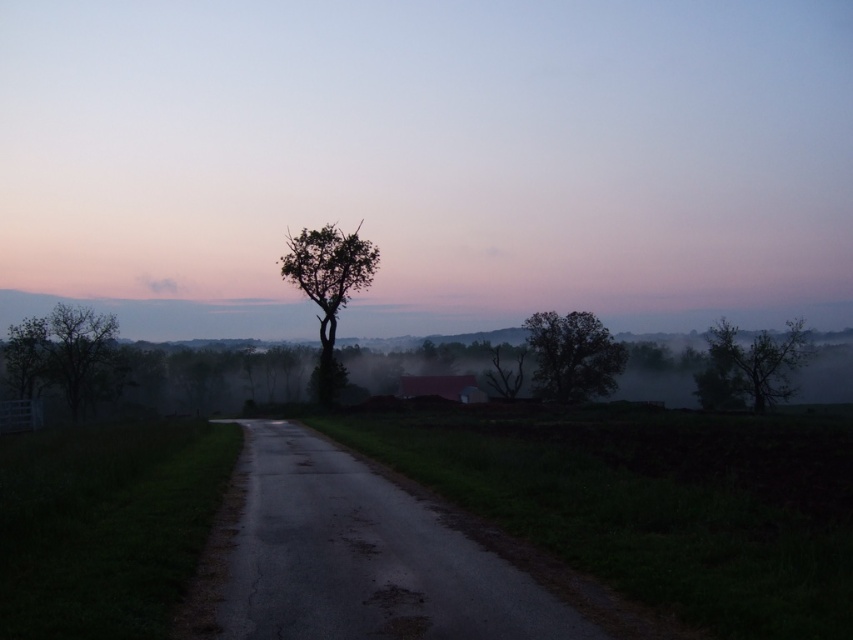
Looking at this image, you are driving along the road and notice two trees at the center of the image. Which one is closer to your car, the green leafy tree at center or the silhouette leafy tree at center?

The green leafy tree at center is closer to your car because it is in front of the silhouette leafy tree at center.

You are standing on the paved road in the scene and looking towards the horizon. Which of the two trees, the green leafy tree at center or the silhouette leafy tree at center, is positioned to the left from your perspective?

The green leafy tree at center is positioned to the left of the silhouette leafy tree at center, so from your perspective on the road, the green leafy tree at center is the one to the left.

You are a hiker standing on the paved road and looking towards the horizon. You notice a smooth bark tree at right and a silhouette leafy tree at center. Which tree appears closer to you based on their positions?

The smooth bark tree at right is located above the silhouette leafy tree at center, so the silhouette leafy tree at center appears closer to you.